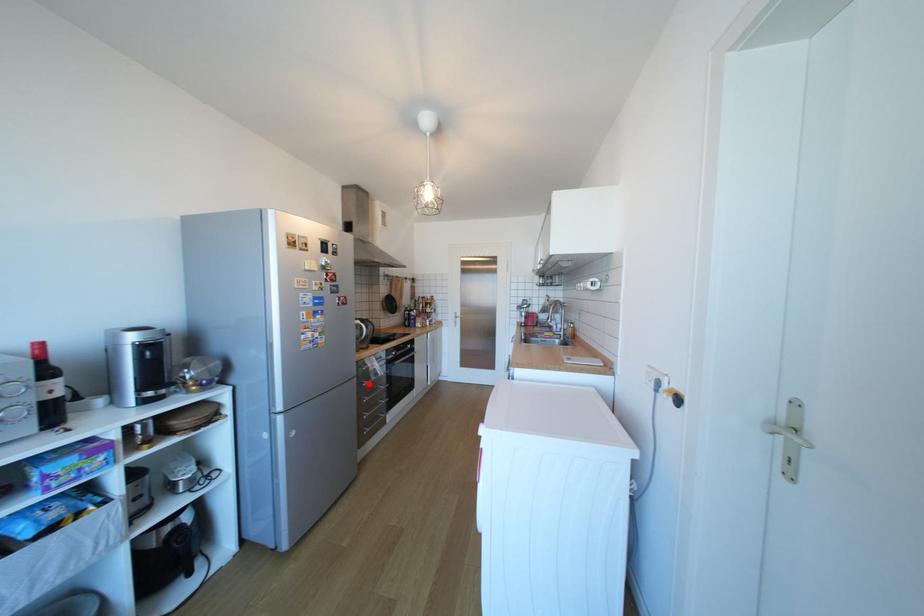
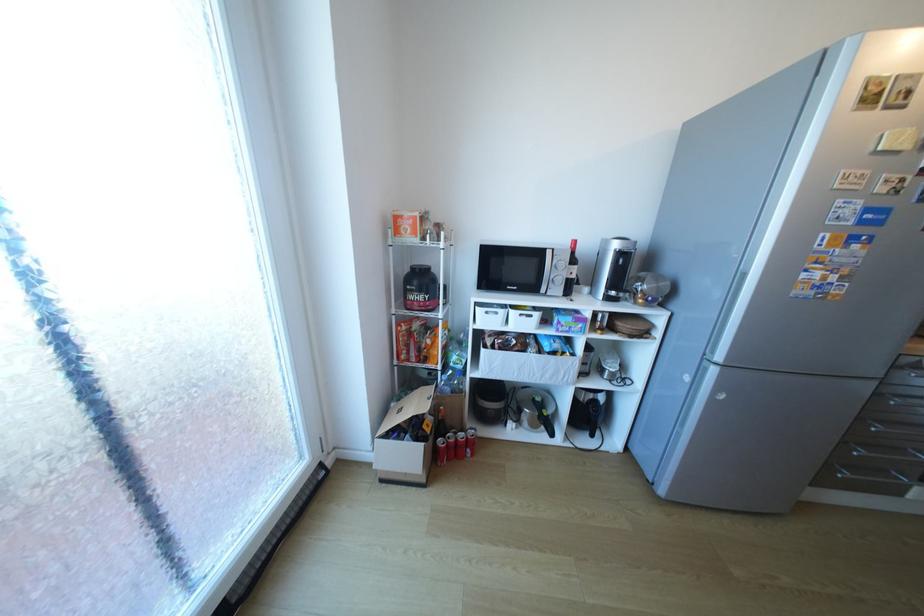
Question: I am providing you with two images of the same scene from different viewpoints. Image1 has a red point marked. In image2, the corresponding 3D location appears at what relative position? Reply with the corresponding letter.

Choices:
 (A) Closer
 (B) Farther

Answer: (A)